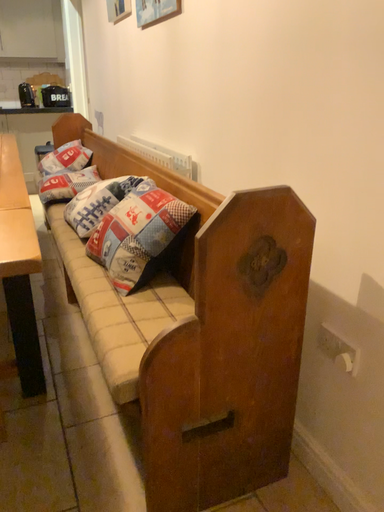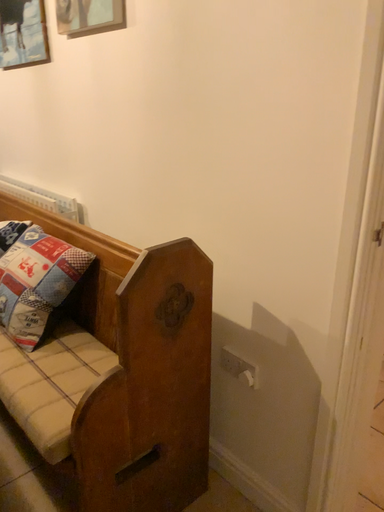
Question: Which way did the camera rotate in the video?

Choices:
 (A) rotated left
 (B) rotated right

Answer: (B)